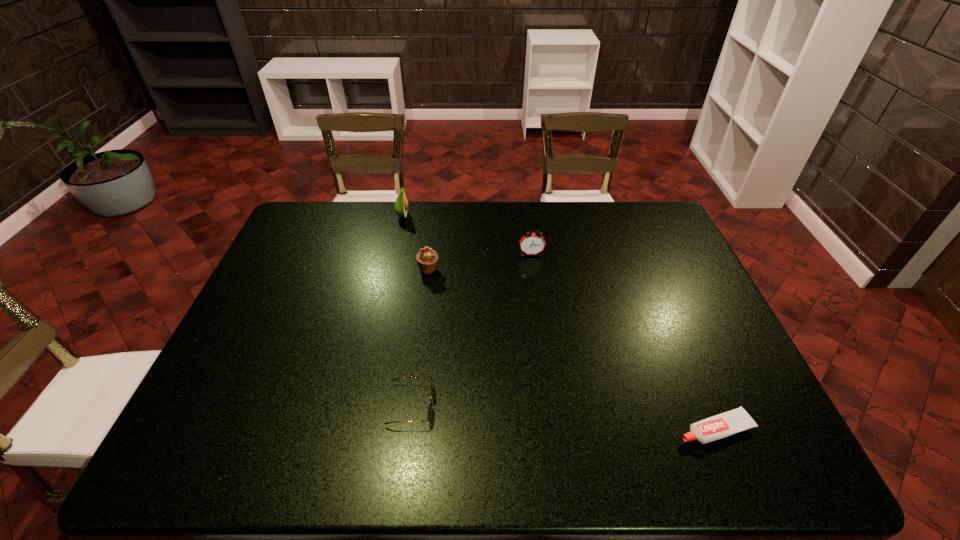
The image size is (960, 540). I want to click on blank space that satisfies the following two spatial constraints: 1. on the cut side of the leftmost object; 2. on the back side of the toothpaste, so click(356, 428).

The height and width of the screenshot is (540, 960). Identify the location of vacant space that satisfies the following two spatial constraints: 1. on the cut side of the avocado; 2. on the back side of the muffin. (391, 269).

This screenshot has width=960, height=540. What are the coordinates of `free space in the image that satisfies the following two spatial constraints: 1. on the cut side of the leftmost object; 2. on the left side of the shortest object` in the screenshot? It's located at (356, 428).

Find the location of a particular element. free space that satisfies the following two spatial constraints: 1. on the lenses of the shortest object; 2. on the left side of the fourth tallest object is located at coordinates (408, 428).